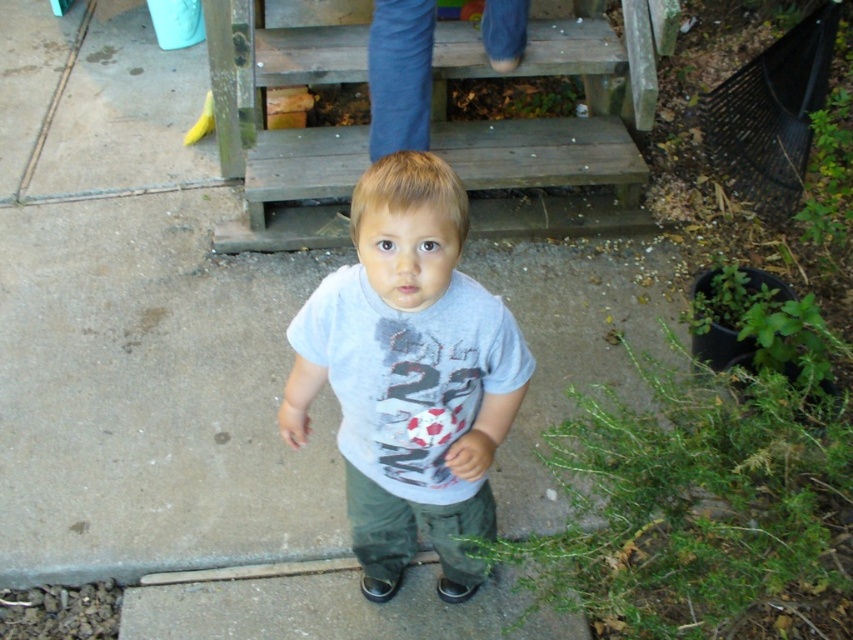
Based on the scene description, can you tell which object is smaller in size between the gray cotton shirt at center and the wooden stairs at upper center?

The gray cotton shirt at center has a smaller size compared to the wooden stairs at upper center.

You are a photographer trying to capture the gray cotton shirt at center and the wooden stairs at upper center in the same frame. Based on their positions, which object should appear larger in the photo?

The gray cotton shirt at center is taller than the wooden stairs at upper center, so it should appear larger in the photo.

Where is the gray cotton shirt at center located in the image?

The gray cotton shirt at center is located at point (409, 376) in the image.